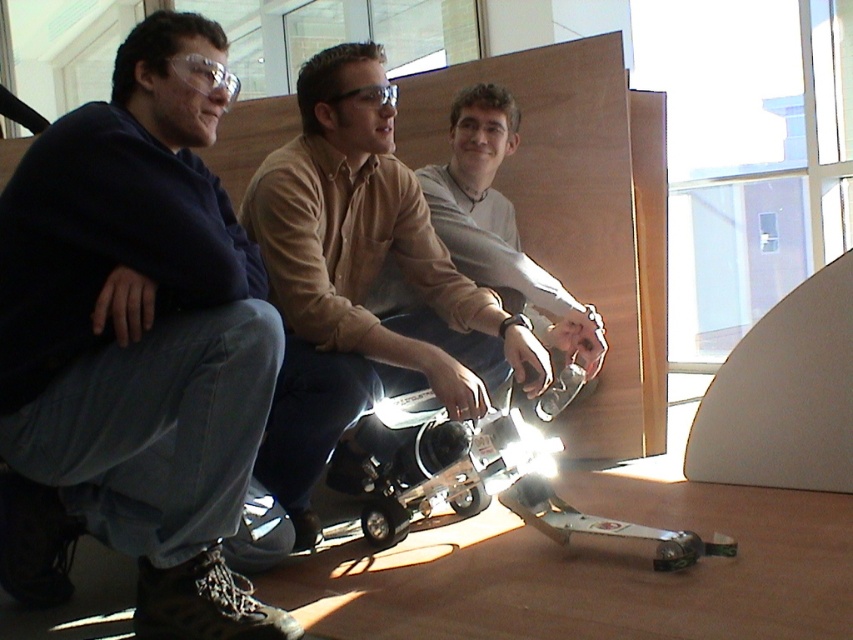
You are a visitor in this office and want to take a photo of the metallic silver drone at center without blocking the matte brown shirt at center. Which side should you stand to take the photo?

You should stand to the right side of the scene because the matte brown shirt at center is to the left of the metallic silver drone at center, so positioning yourself to the right would allow you to capture the drone without the shirt blocking it.

You are standing in the office and need to move from point A to point B. Point A is at coordinates point (283, 312) and point B is at coordinates point (445, 442). Which point is closer to you if you are facing the direction the middle person is looking?

Point (283, 312) is in front of point (445, 442), so if you are facing the direction the middle person is looking, point (283, 312) would be closer to you.

Which person is wearing the matte brown shirt at center?

The individual in the middle is wearing the matte brown shirt at center.